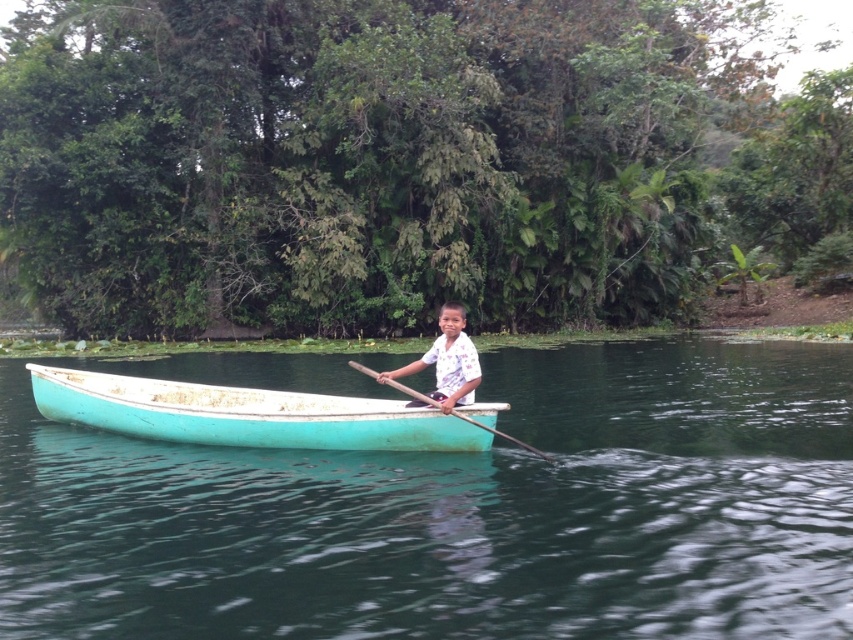
Find the location of a particular element. This screenshot has width=853, height=640. teal painted wood boat at center is located at coordinates (245, 413).

Locate an element on the screen. Image resolution: width=853 pixels, height=640 pixels. teal painted wood boat at center is located at coordinates (245, 413).

Measure the distance from teal painted wood boat at center to wooden at center.

1.65 meters

Which is in front, point (125, 392) or point (527, 449)?

Positioned in front is point (527, 449).

Is point (67, 369) more distant than point (387, 380)?

That is True.

Where is `teal painted wood boat at center`? This screenshot has width=853, height=640. teal painted wood boat at center is located at coordinates (245, 413).

This screenshot has width=853, height=640. I want to click on teal wooden boat at center, so click(461, 513).

Is teal wooden boat at center closer to camera compared to white printed shirt at center?

Yes, teal wooden boat at center is closer to the viewer.

Find the location of a particular element. teal wooden boat at center is located at coordinates (461, 513).